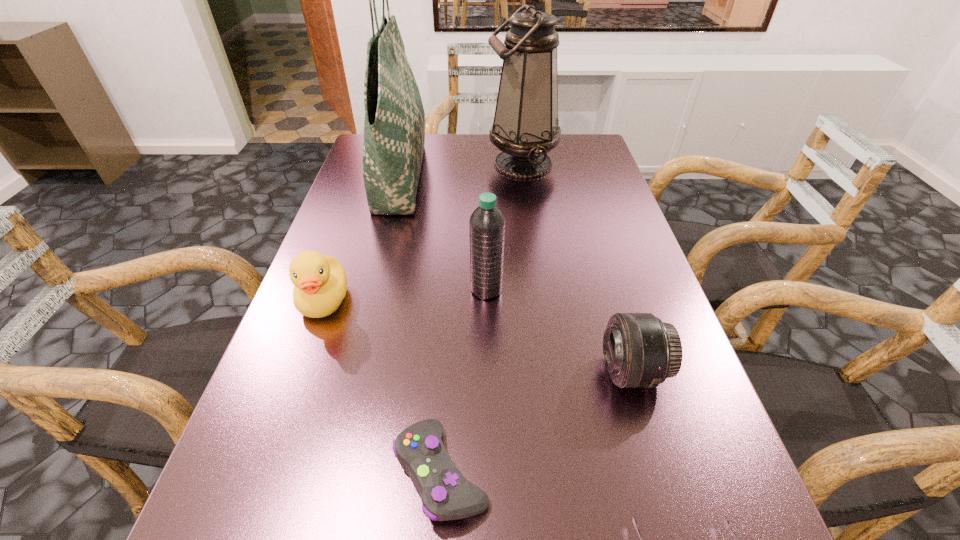
The image size is (960, 540). In order to click on empty space between the water bottle and the tallest object in this screenshot , I will do `click(444, 232)`.

Where is `unoccupied position between the duck and the tallest object`? unoccupied position between the duck and the tallest object is located at coordinates (362, 238).

In order to click on empty space that is in between the third tallest object and the telephoto lens in this screenshot , I will do `click(559, 330)`.

The image size is (960, 540). Find the location of `free spot between the second tallest object and the duck`. free spot between the second tallest object and the duck is located at coordinates (423, 232).

The width and height of the screenshot is (960, 540). In order to click on the fifth closest object to the duck in this screenshot , I will do `click(640, 351)`.

Select which object is the fifth closest to the sixth tallest object. Please provide its 2D coordinates. Your answer should be formatted as a tuple, i.e. [(x, y)], where the tuple contains the x and y coordinates of a point satisfying the conditions above.

[(394, 128)]

This screenshot has width=960, height=540. What are the coordinates of `vacant space that satisfies the following two spatial constraints: 1. on the back side of the tallest object; 2. on the right side of the oil lamp` in the screenshot? It's located at 403,164.

Locate an element on the screen. This screenshot has width=960, height=540. free point that satisfies the following two spatial constraints: 1. on the back side of the oil lamp; 2. on the right side of the water bottle is located at coordinates [485, 164].